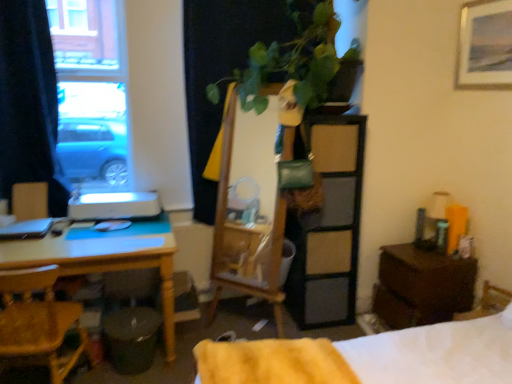
Question: Can you confirm if matte wood armchair at left is thinner than yellow wood chair at lower left?

Choices:
 (A) no
 (B) yes

Answer: (B)

Question: Is matte wood armchair at left far from yellow wood chair at lower left?

Choices:
 (A) no
 (B) yes

Answer: (A)

Question: Is the position of matte wood armchair at left more distant than that of yellow wood chair at lower left?

Choices:
 (A) no
 (B) yes

Answer: (B)

Question: Is matte wood armchair at left bigger than yellow wood chair at lower left?

Choices:
 (A) no
 (B) yes

Answer: (A)

Question: Can yellow wood chair at lower left be found inside matte wood armchair at left?

Choices:
 (A) yes
 (B) no

Answer: (B)

Question: From a real-world perspective, is yellow wood desk at left positioned above or below yellow fluffy blanket at lower center?

Choices:
 (A) above
 (B) below

Answer: (B)

Question: Relative to yellow fluffy blanket at lower center, is yellow wood desk at left in front or behind?

Choices:
 (A) front
 (B) behind

Answer: (B)

Question: Is point (125, 269) closer or farther from the camera than point (324, 357)?

Choices:
 (A) farther
 (B) closer

Answer: (A)

Question: Is yellow wood desk at left wider or thinner than yellow fluffy blanket at lower center?

Choices:
 (A) thin
 (B) wide

Answer: (B)

Question: Would you say wooden mirror at center, which is the second dresser in right-to-left order, is to the left or to the right of yellow wood chair at lower left in the picture?

Choices:
 (A) left
 (B) right

Answer: (B)

Question: Does point (325, 302) appear closer or farther from the camera than point (26, 279)?

Choices:
 (A) farther
 (B) closer

Answer: (A)

Question: Considering their positions, is wooden mirror at center, which is the first dresser in left-to-right order, located in front of or behind yellow wood chair at lower left?

Choices:
 (A) behind
 (B) front

Answer: (A)

Question: In terms of height, does wooden mirror at center, which is the second dresser in right-to-left order, look taller or shorter compared to yellow wood chair at lower left?

Choices:
 (A) short
 (B) tall

Answer: (B)

Question: Considering the relative positions of white soft bed at lower right and black fabric curtain at left in the image provided, is white soft bed at lower right to the left or to the right of black fabric curtain at left?

Choices:
 (A) right
 (B) left

Answer: (A)

Question: Is white soft bed at lower right in front of or behind black fabric curtain at left in the image?

Choices:
 (A) front
 (B) behind

Answer: (A)